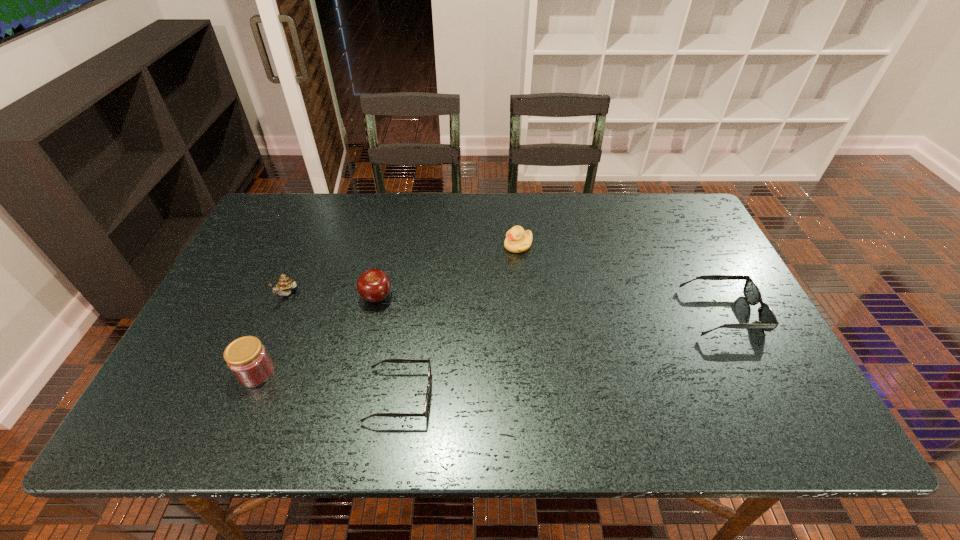
To achieve uniform spacing by inserting another sunglasses among them, please point to a free space for this new sunglasses. Please provide its 2D coordinates. Your answer should be formatted as a tuple, i.e. [(x, y)], where the tuple contains the x and y coordinates of a point satisfying the conditions above.

[(573, 351)]